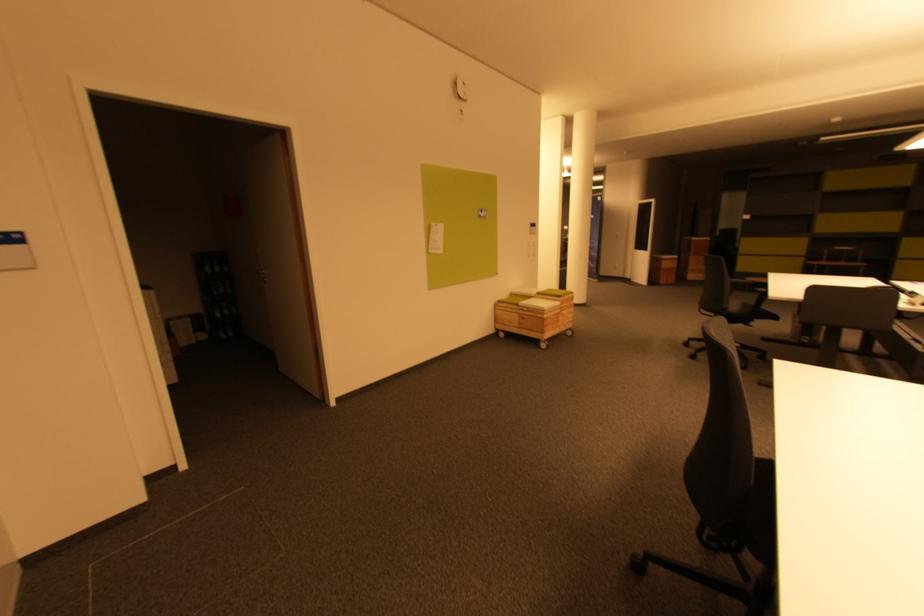
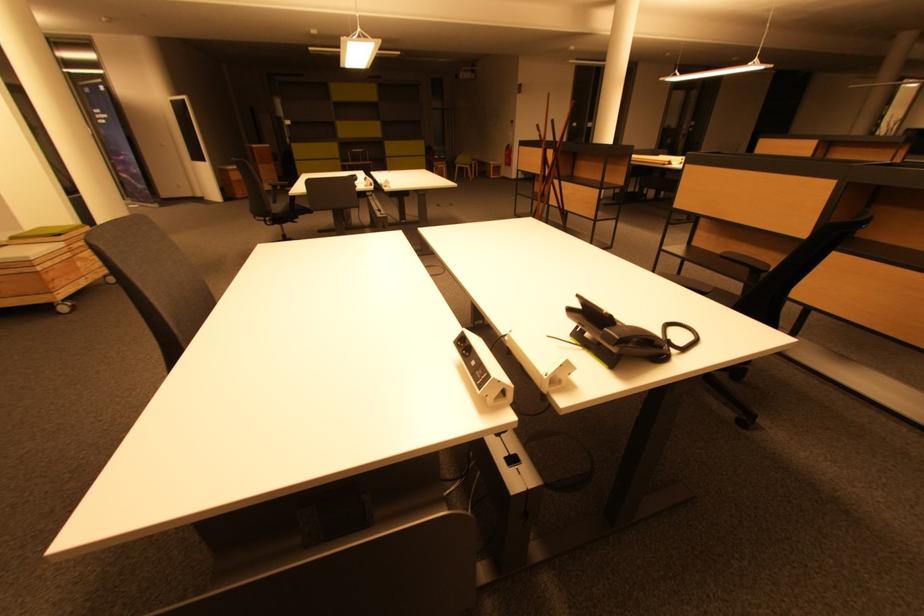
The first image is from the beginning of the video and the second image is from the end. How did the camera likely rotate when shooting the video?

The rotation direction of the camera is right-down.